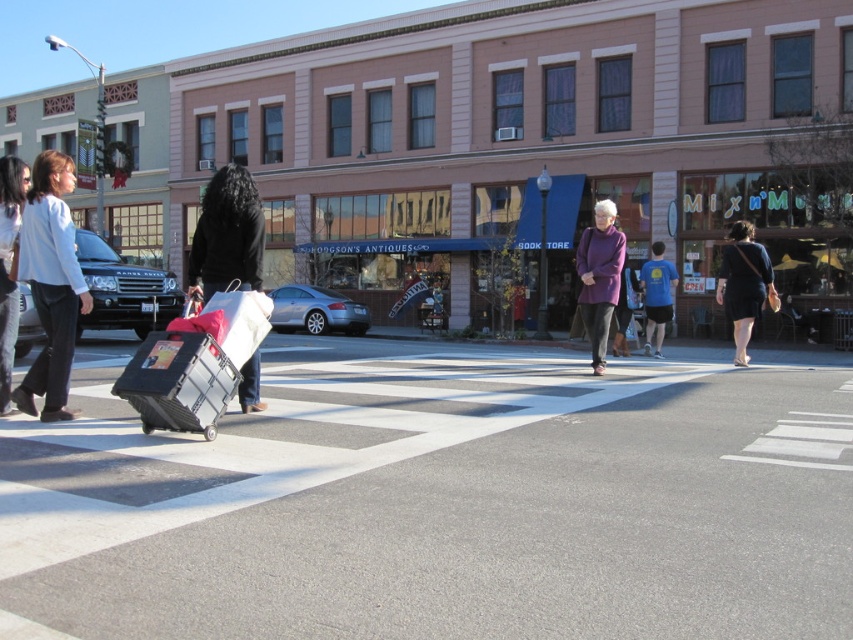
Is black fabric bag at center in front of purple woolen sweater at center?

Yes, black fabric bag at center is closer to the viewer.

Who is lower down, black fabric bag at center or purple woolen sweater at center?

Positioned lower is purple woolen sweater at center.

Between point (238, 189) and point (595, 337), which one is positioned behind?

The point (595, 337) is behind.

Where is `black fabric bag at center`? The width and height of the screenshot is (853, 640). black fabric bag at center is located at coordinates (227, 234).

Does point (315, 451) lie in front of point (206, 285)?

Yes, point (315, 451) is closer to viewer.

Who is taller, black plastic cart at center or black fabric bag at center?

black fabric bag at center is taller.

Is point (699, 352) in front of point (190, 288)?

No.

Locate an element on the screen. black plastic cart at center is located at coordinates (445, 502).

Find the location of `black plastic cart at center`. black plastic cart at center is located at coordinates (445, 502).

The image size is (853, 640). What do you see at coordinates (445, 502) in the screenshot?
I see `black plastic cart at center` at bounding box center [445, 502].

Does point (161, 636) come farther from viewer compared to point (57, 321)?

That is False.

Where is `black plastic cart at center`? This screenshot has height=640, width=853. black plastic cart at center is located at coordinates (445, 502).